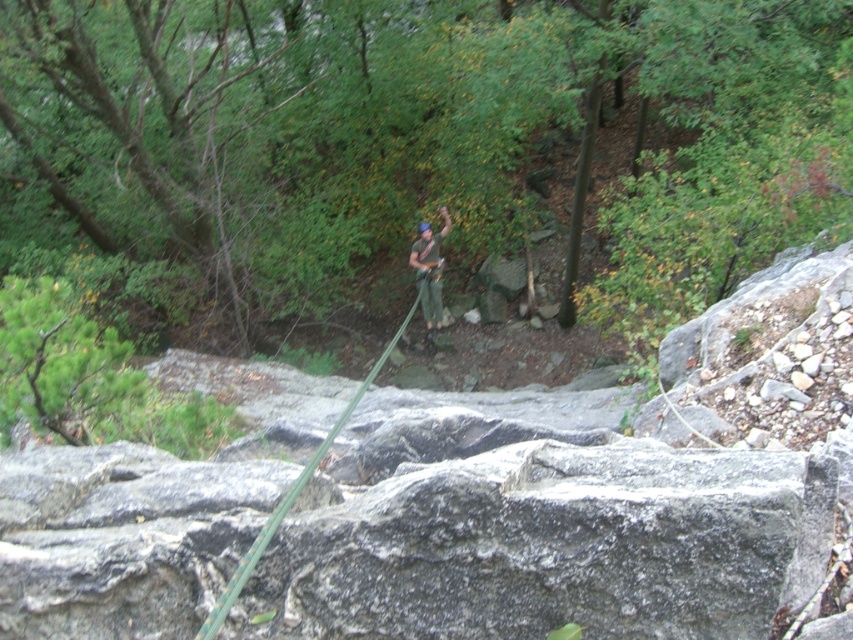
You are a hiker trying to estimate distances in the scene. Which object, the green leafy tree at center or the green fabric harness at center, appears wider from your viewpoint?

The green leafy tree at center appears wider than the green fabric harness at center because the tree has a greater width.

You are a hiker trying to locate your gear. You see a green leafy tree at center and a green fabric harness at center. Which object is located to the right of the other?

The green leafy tree at center is positioned on the right side of green fabric harness at center, so the tree is to the right of the harness.